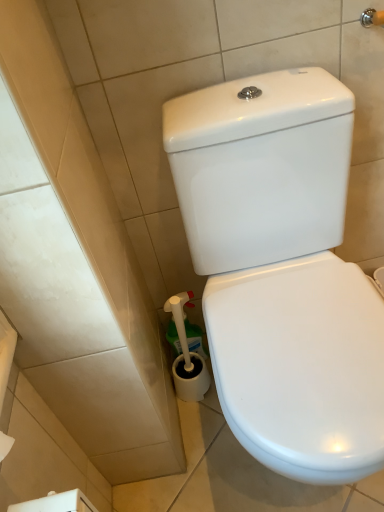
Question: Visually, is white glossy toilet at center positioned to the left or to the right of white plastic toilet brush at lower left?

Choices:
 (A) left
 (B) right

Answer: (B)

Question: Is point coord(326,381) closer or farther from the camera than point coord(180,348)?

Choices:
 (A) closer
 (B) farther

Answer: (A)

Question: Relative to white plastic toilet brush at lower left, is white glossy toilet at center in front or behind?

Choices:
 (A) behind
 (B) front

Answer: (B)

Question: Looking at their shapes, would you say white plastic toilet brush at lower left is wider or thinner than white glossy toilet at center?

Choices:
 (A) wide
 (B) thin

Answer: (B)

Question: Considering the positions of white plastic toilet brush at lower left and white glossy toilet at center in the image, is white plastic toilet brush at lower left bigger or smaller than white glossy toilet at center?

Choices:
 (A) big
 (B) small

Answer: (B)

Question: From the image's perspective, relative to white glossy toilet at center, is white plastic toilet brush at lower left above or below?

Choices:
 (A) below
 (B) above

Answer: (A)

Question: Is point (180, 394) closer or farther from the camera than point (274, 328)?

Choices:
 (A) farther
 (B) closer

Answer: (A)